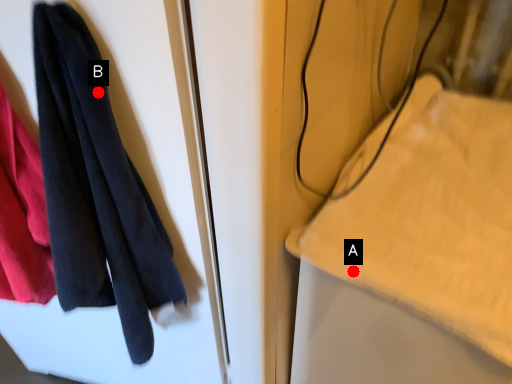
Question: Two points are circled on the image, labeled by A and B beside each circle. Which point is closer to the camera taking this photo?

Choices:
 (A) A is closer
 (B) B is closer

Answer: (B)